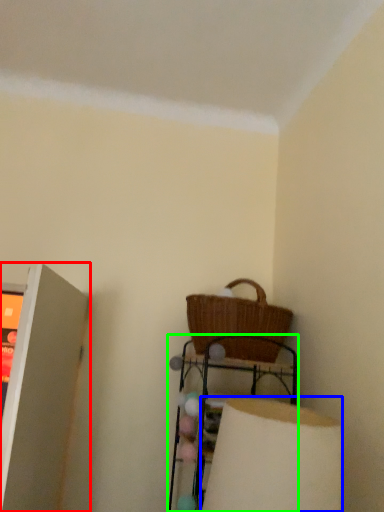
Question: Considering the real-world distances, which object is farthest from shelf (highlighted by a red box)? lamp (highlighted by a blue box) or furniture (highlighted by a green box)?

Choices:
 (A) lamp
 (B) furniture

Answer: (A)